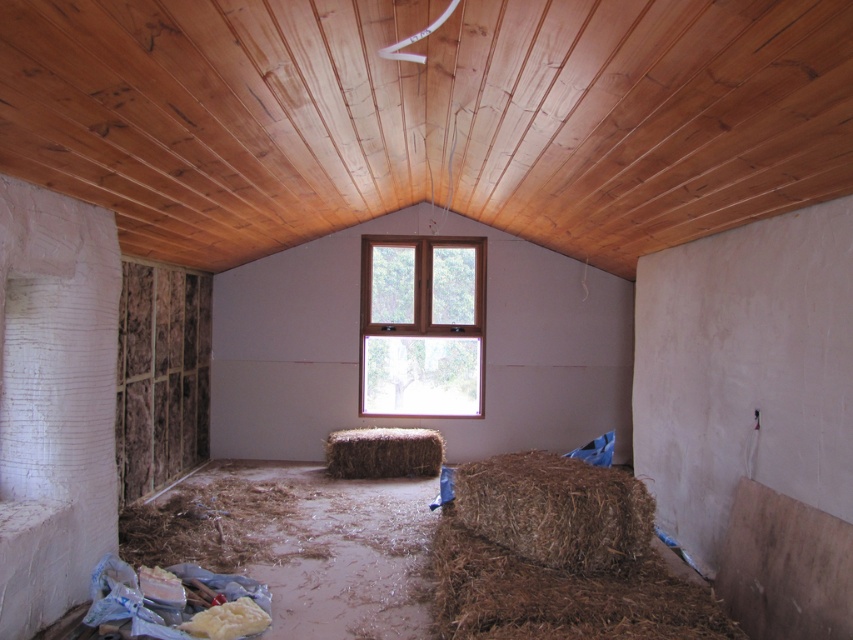
You are a contractor assessing the space for storage. You have a large box that is 1.2 meters in length. Can the brown straw bale at lower right and the brown wooden window at center accommodate this box? Please explain based on their sizes.

The brown straw bale at lower right is bigger than the brown wooden window at center. Since the box is 1.2 meters long, it might fit on the brown straw bale at lower right if its dimensions align, but the brown wooden window at center is smaller and likely cannot accommodate the box.

You are standing in the construction site of a room with a diagonal wooden ceiling and unfinished walls. You see a point marked at coordinates (558,557). What object does this point correspond to?

The point corresponds to the brown straw bale at lower right.